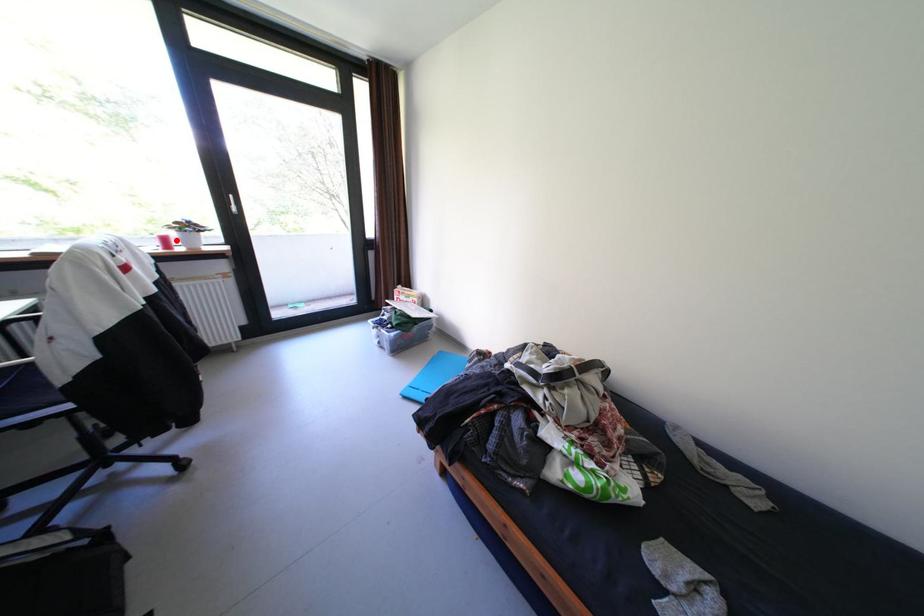
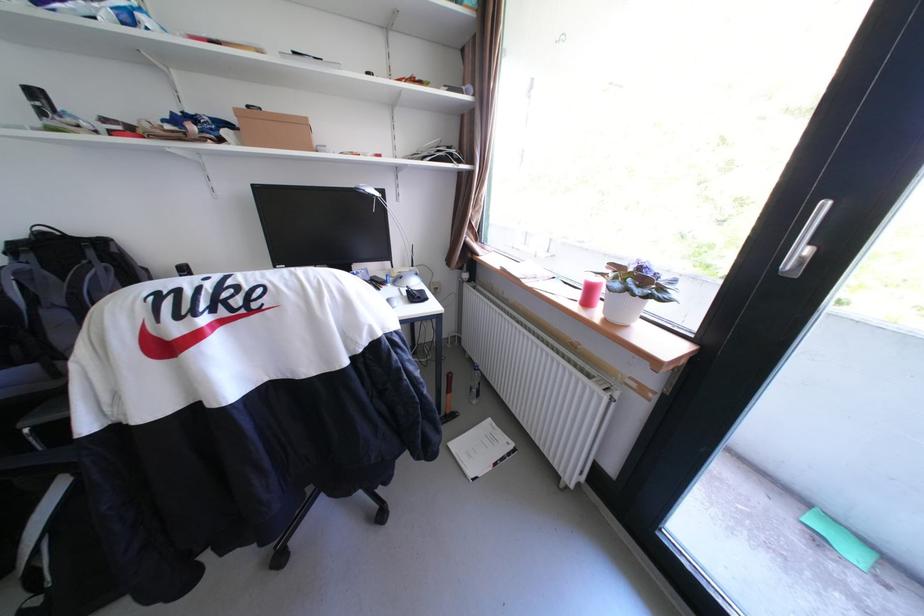
Locate, in the second image, the point that corresponds to the highlighted location in the first image.

(601, 291)